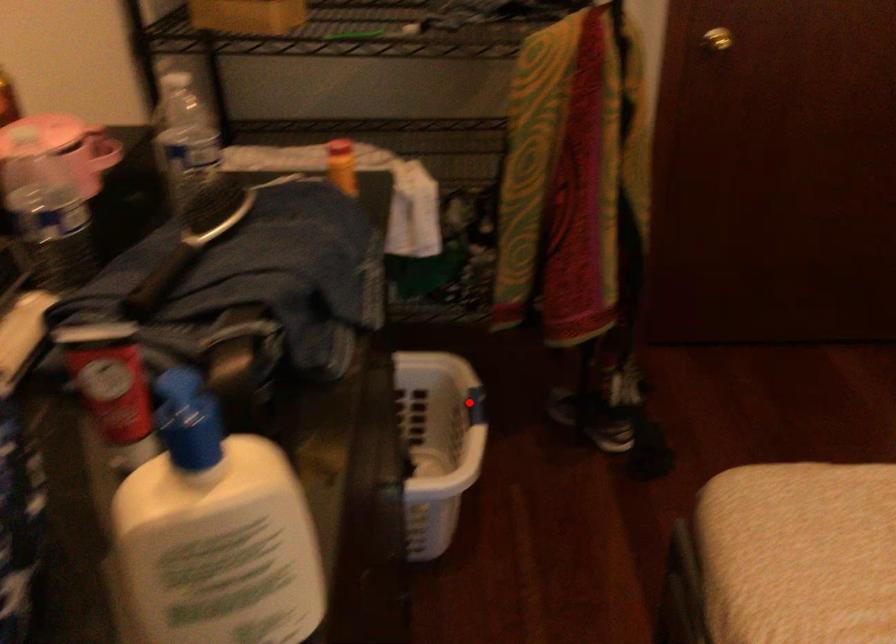
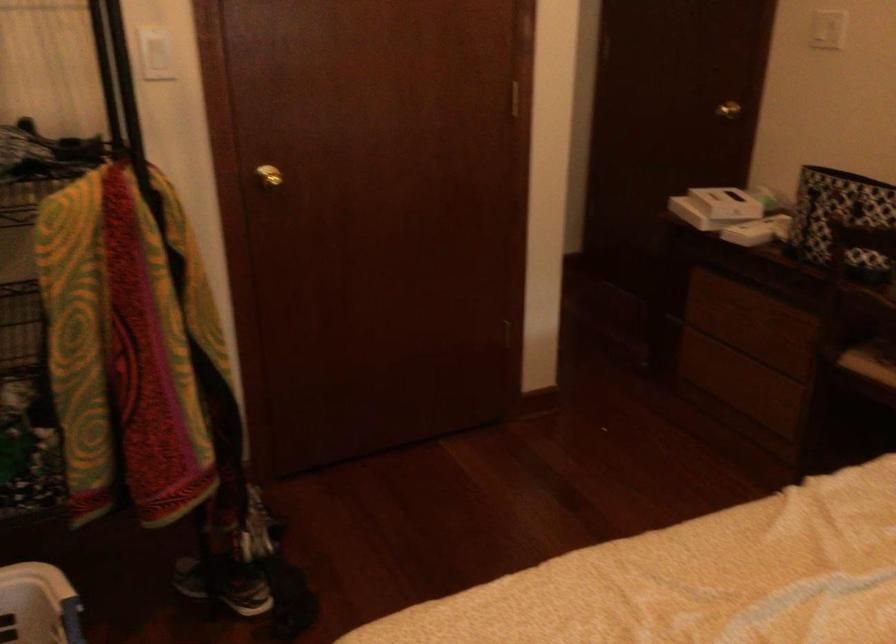
The point at the highlighted location is marked in the first image. Where is the corresponding point in the second image?

(63, 616)